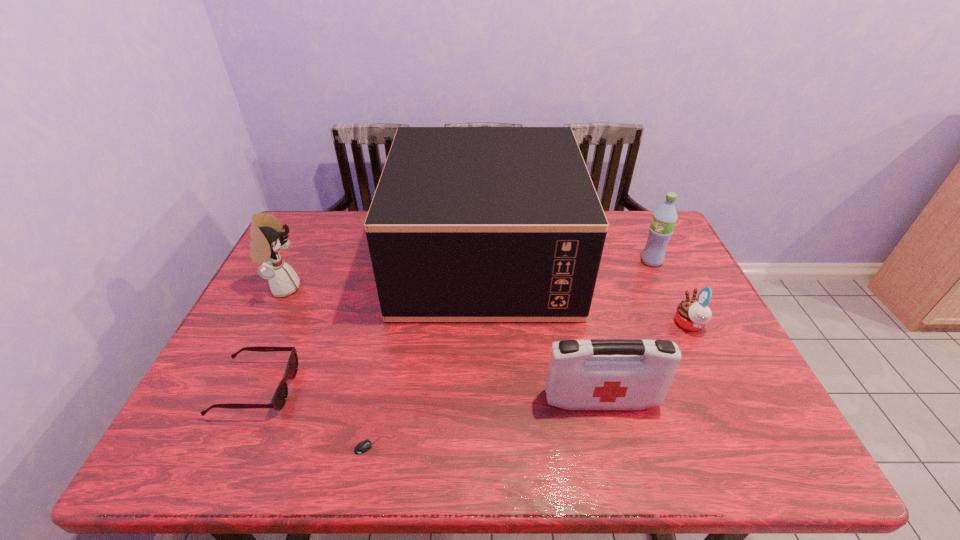
The image size is (960, 540). In order to click on vacant area at the near right corner of the desktop in this screenshot , I will do `click(728, 436)`.

Image resolution: width=960 pixels, height=540 pixels. Find the location of `vacant point located between the water bottle and the second shortest object`. vacant point located between the water bottle and the second shortest object is located at coordinates (453, 325).

Locate an element on the screen. free space between the sunglasses and the tallest object is located at coordinates [371, 323].

Where is `blank region between the third shortest object and the sunglasses`? This screenshot has width=960, height=540. blank region between the third shortest object and the sunglasses is located at coordinates (472, 356).

I want to click on empty location between the fifth tallest object and the nearest object, so click(532, 384).

What are the coordinates of `empty space that is in between the first-aid kit and the second shortest object` in the screenshot? It's located at (428, 394).

You are a GUI agent. You are given a task and a screenshot of the screen. Output one action in this format:
    pyautogui.click(x=<x>, y=<y>)
    Task: Click on the blank region between the shortest object and the water bottle
    
    Given the screenshot: What is the action you would take?
    pyautogui.click(x=513, y=353)

At what (x,y) coordinates should I click in order to perform the action: click on free space between the shortest object and the doll. Please return your answer as a coordinate pair (x, y). The width and height of the screenshot is (960, 540). Looking at the image, I should click on (328, 367).

The width and height of the screenshot is (960, 540). I want to click on vacant area that lies between the mouse and the tallest object, so click(x=429, y=352).

At what (x,y) coordinates should I click in order to perform the action: click on vacant area between the muffin and the nearest object. Please return your answer as a coordinate pair (x, y). The height and width of the screenshot is (540, 960). Looking at the image, I should click on (532, 384).